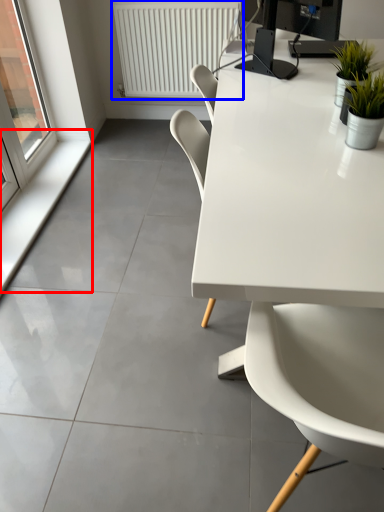
Question: Which point is closer to the camera, window sill (highlighted by a red box) or radiator (highlighted by a blue box)?

Choices:
 (A) window sill
 (B) radiator

Answer: (A)